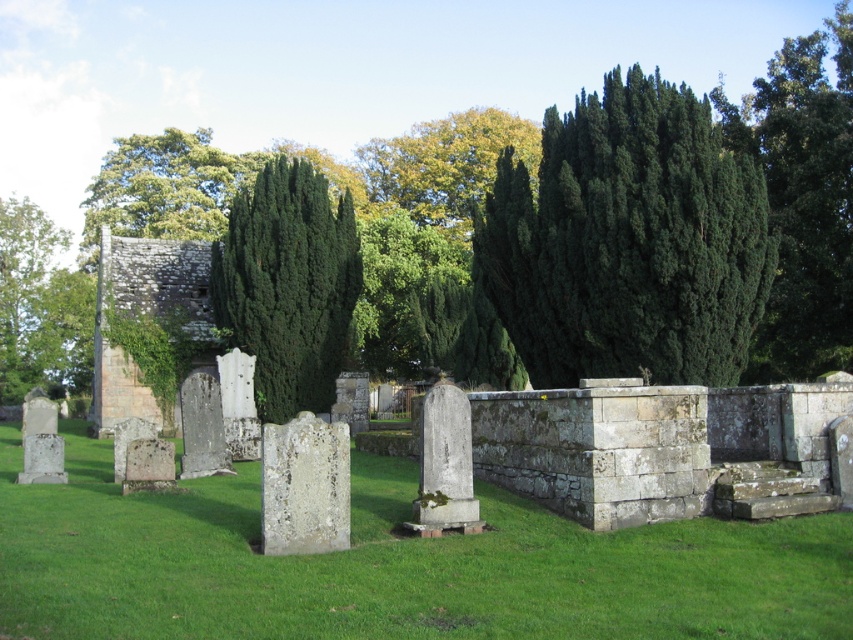
You are a groundskeeper planning to plant a new tree in the cemetery. The green leafy tree at upper left and the white stone gravestone at center are both in the area. Considering the distance between them, can you safely plant a new tree that requires 200 feet of space between it and existing trees or monuments?

The green leafy tree at upper left and the white stone gravestone at center are 275.69 feet apart. Since the required space is 200 feet, planting a new tree between them would be possible as the distance exceeds the required 200 feet.

You are standing at point (164, 188) in the cemetery. What do you see in the direction of the upper left?

At point (164, 188) lies green leafy tree at upper left.

You are a groundskeeper who needs to water the green leafy tree at upper center and the white stone gravestone at center. Your watering can holds enough water for 15 meters of travel. Can you water both without refilling?

The distance between the green leafy tree at upper center and the white stone gravestone at center is 17.97 meters, which exceeds the 15 meters your watering can can handle. You will need to refill before you can water both.